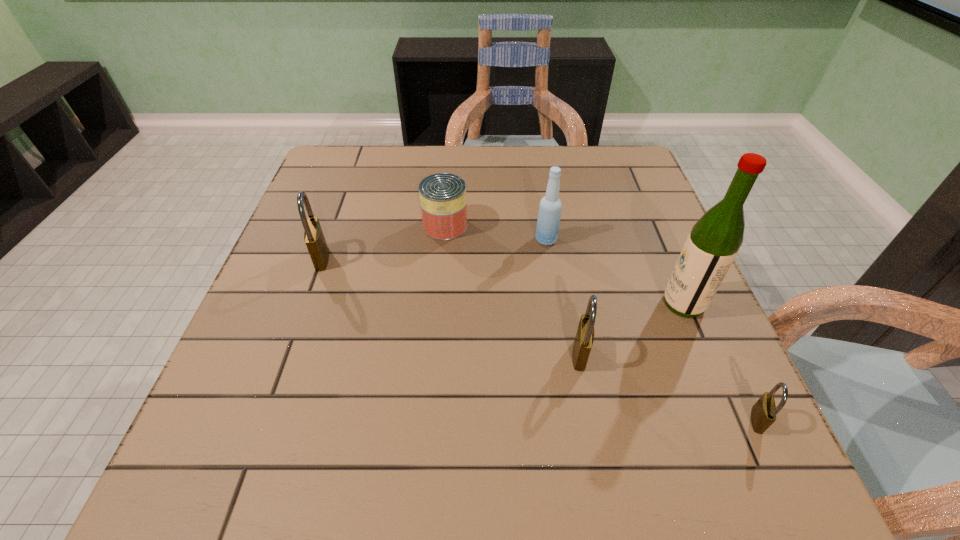
Locate an element on the screen. The height and width of the screenshot is (540, 960). free space that is in between the second object from left to right and the bottle is located at coordinates click(x=495, y=233).

Image resolution: width=960 pixels, height=540 pixels. In order to click on vacant space that's between the shortest object and the second padlock from right to left in this screenshot , I will do `click(668, 387)`.

The image size is (960, 540). Identify the location of vacant area between the bottle and the tallest object. (614, 272).

The width and height of the screenshot is (960, 540). I want to click on vacant space that's between the third nearest object and the second padlock from left to right, so click(632, 329).

I want to click on blank region between the shortest padlock and the bottle, so click(x=652, y=330).

Locate an element on the screen. The height and width of the screenshot is (540, 960). unoccupied area between the second padlock from right to left and the leftmost padlock is located at coordinates (451, 306).

What are the coordinates of `unoccupied position between the fifth farthest object and the bottle` in the screenshot? It's located at (563, 297).

Locate an element on the screen. The height and width of the screenshot is (540, 960). free space between the shortest padlock and the leftmost padlock is located at coordinates (540, 339).

You are a GUI agent. You are given a task and a screenshot of the screen. Output one action in this format:
    pyautogui.click(x=<x>, y=<y>)
    Task: Click on the empty space between the second padlock from left to right and the shortest object
    This screenshot has height=540, width=960.
    Given the screenshot: What is the action you would take?
    [x=668, y=387]

Choose which object is the second nearest neighbor to the shortest padlock. Please provide its 2D coordinates. Your answer should be formatted as a tuple, i.e. [(x, y)], where the tuple contains the x and y coordinates of a point satisfying the conditions above.

[(584, 338)]